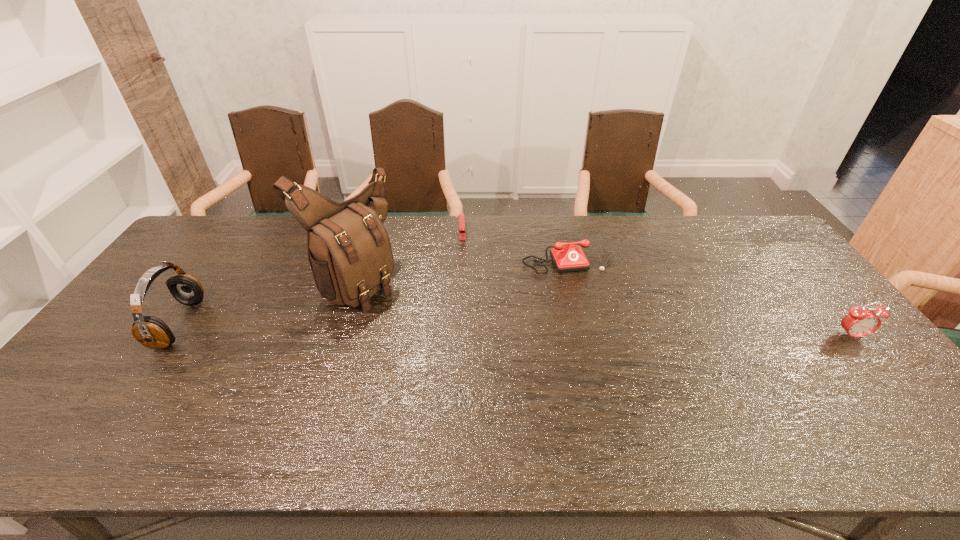
In the image, there is a desktop. At what (x,y) coordinates should I click in order to perform the action: click on vacant space at the far right corner. Please return your answer as a coordinate pair (x, y). Image resolution: width=960 pixels, height=540 pixels. Looking at the image, I should click on [773, 240].

In order to click on free spot between the leftmost object and the third shortest object in this screenshot , I will do `click(515, 330)`.

This screenshot has width=960, height=540. I want to click on free space between the tallest object and the leftmost object, so click(268, 302).

Image resolution: width=960 pixels, height=540 pixels. I want to click on vacant space that's between the headset and the rightmost object, so click(515, 330).

The image size is (960, 540). I want to click on vacant space in between the shoulder bag and the leftmost object, so click(268, 302).

This screenshot has width=960, height=540. I want to click on free spot between the shortest object and the second object from right to left, so click(x=515, y=242).

Image resolution: width=960 pixels, height=540 pixels. What are the coordinates of `free space between the shoulder bag and the shortest object` in the screenshot? It's located at (410, 255).

Locate an element on the screen. The image size is (960, 540). empty space between the second tallest object and the alarm clock is located at coordinates click(515, 330).

Locate which object ranks fourth in proximity to the second shortest object. Please provide its 2D coordinates. Your answer should be formatted as a tuple, i.e. [(x, y)], where the tuple contains the x and y coordinates of a point satisfying the conditions above.

[(152, 332)]

Point out which object is positioned as the fourth nearest to the leftmost object. Please provide its 2D coordinates. Your answer should be formatted as a tuple, i.e. [(x, y)], where the tuple contains the x and y coordinates of a point satisfying the conditions above.

[(860, 322)]